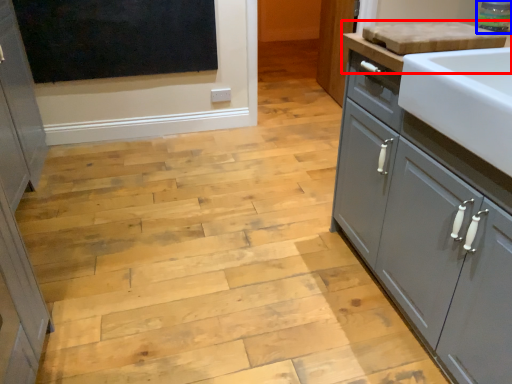
Question: Among these objects, which one is nearest to the camera, countertop (highlighted by a red box) or appliance (highlighted by a blue box)?

Choices:
 (A) countertop
 (B) appliance

Answer: (A)